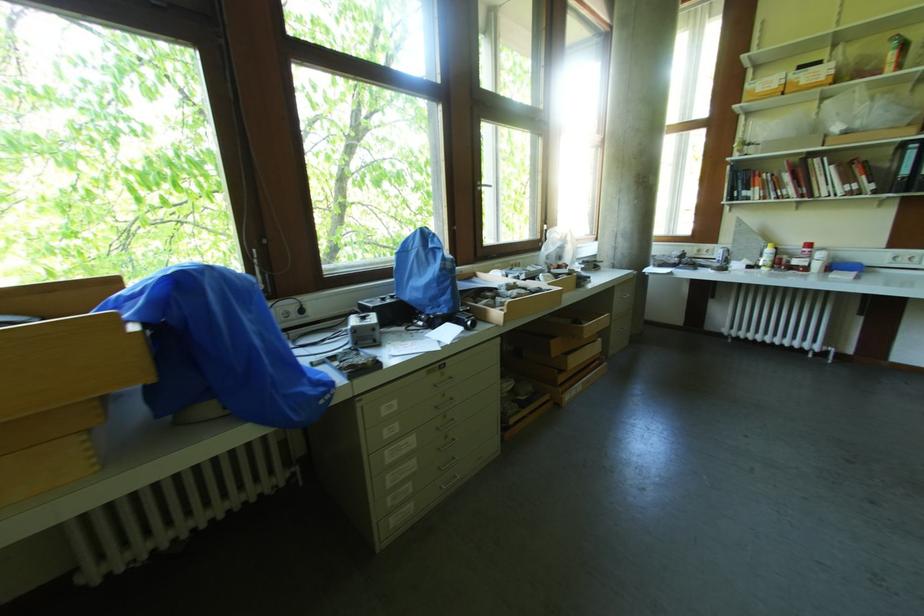
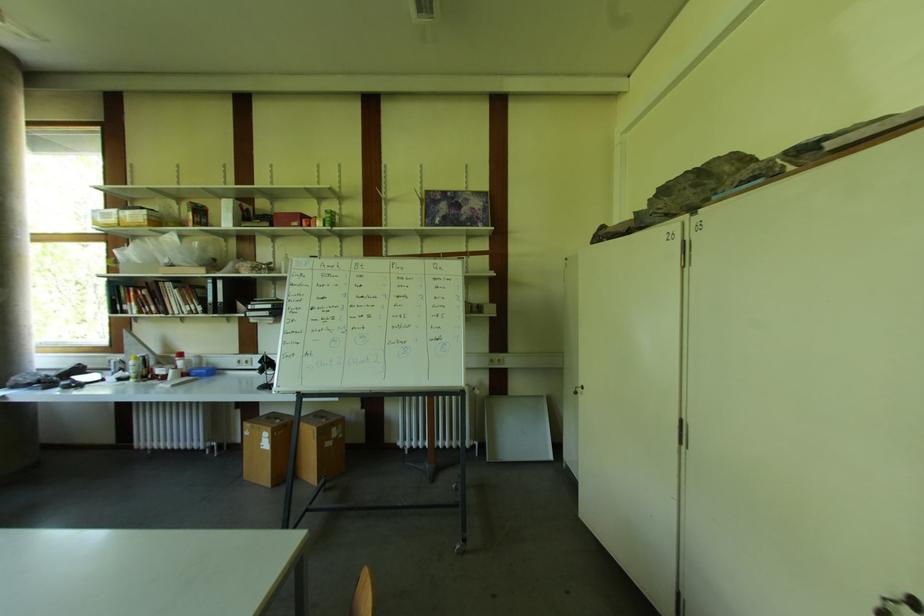
In the second image, find the point that corresponds to point (893, 69) in the first image.

(193, 225)